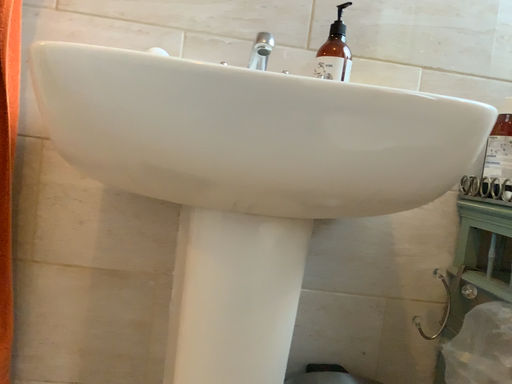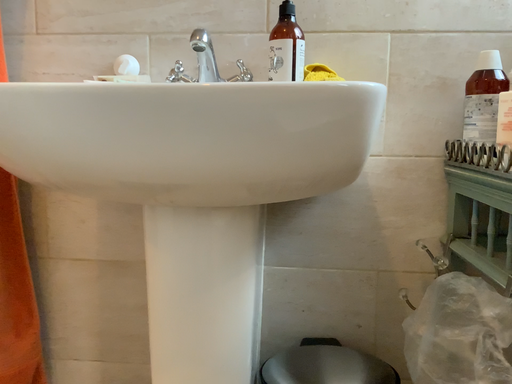
Question: How did the camera likely rotate when shooting the video?

Choices:
 (A) rotated left
 (B) rotated right

Answer: (A)